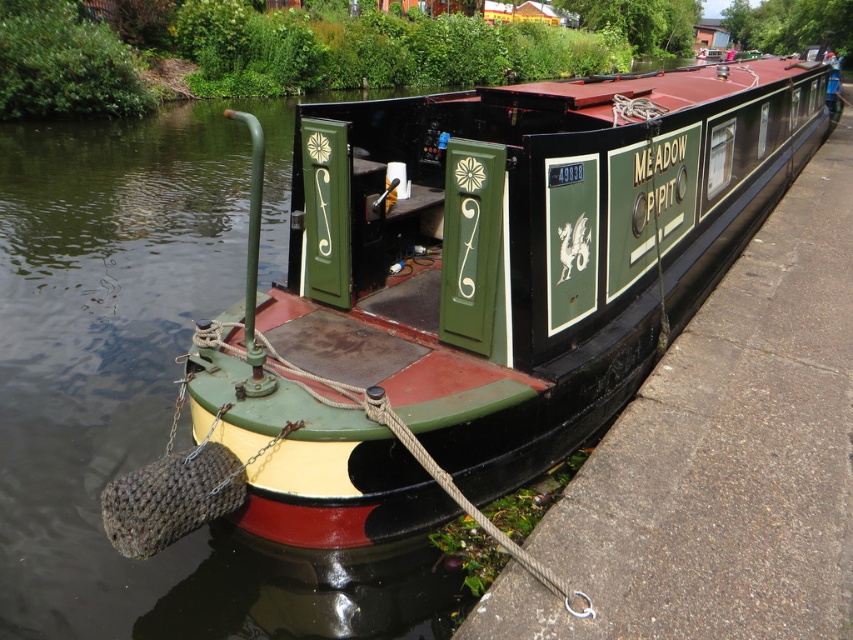
Who is more forward, (277, 452) or (820, 592)?

Point (820, 592) is more forward.

Who is lower down, green polished wood boat at center or green painted wood narrowboat at center?

green painted wood narrowboat at center is lower down.

You are a GUI agent. You are given a task and a screenshot of the screen. Output one action in this format:
    pyautogui.click(x=<x>, y=<y>)
    Task: Click on the green polished wood boat at center
    
    Given the screenshot: What is the action you would take?
    pyautogui.click(x=525, y=244)

Where is `green polished wood boat at center`? This screenshot has height=640, width=853. green polished wood boat at center is located at coordinates (525, 244).